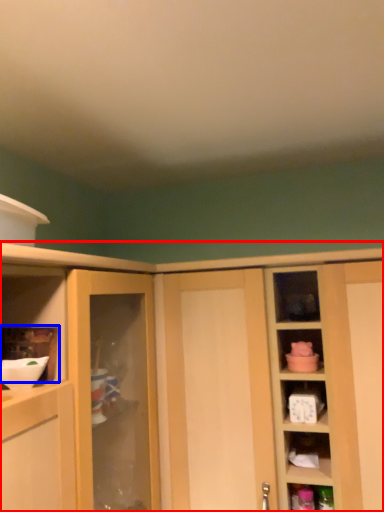
Question: Which point is closer to the camera, cabinetry (highlighted by a red box) or shelf (highlighted by a blue box)?

Choices:
 (A) cabinetry
 (B) shelf

Answer: (B)